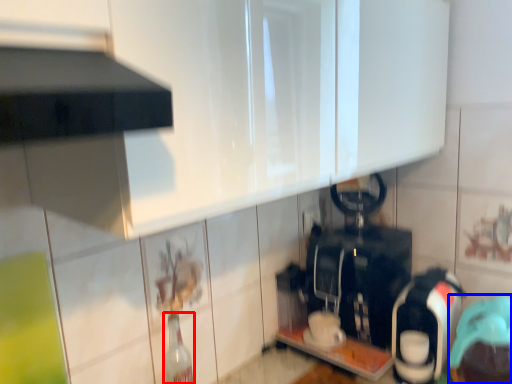
Question: Among these objects, which one is nearest to the camera, bottle (highlighted by a red box) or appliance (highlighted by a blue box)?

Choices:
 (A) bottle
 (B) appliance

Answer: (B)